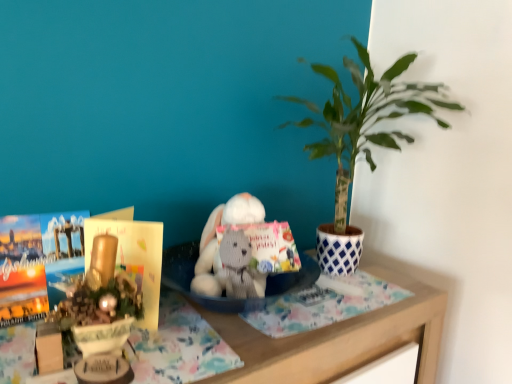
Where is `free point above wooden table at center (from a real-world perspective)`? The height and width of the screenshot is (384, 512). free point above wooden table at center (from a real-world perspective) is located at coordinates (274, 314).